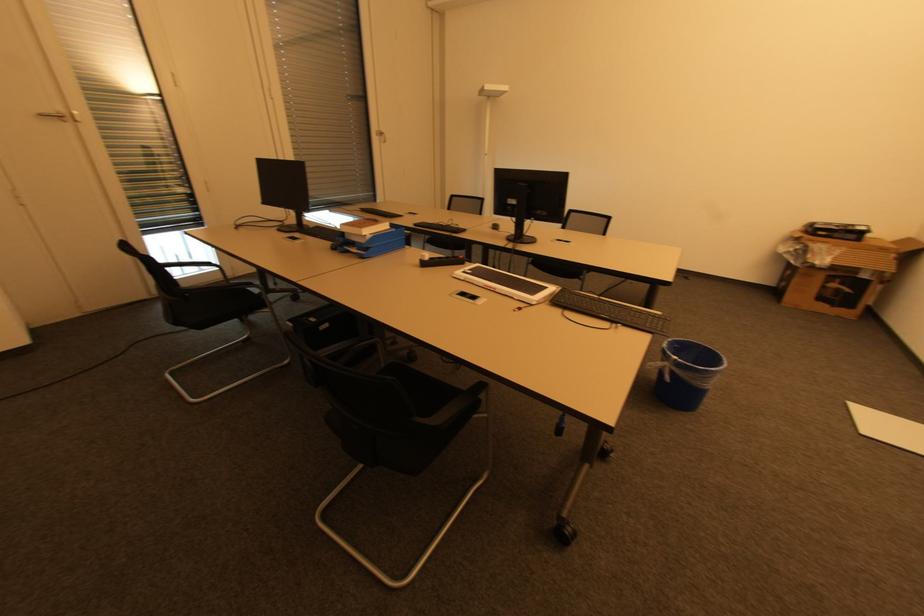
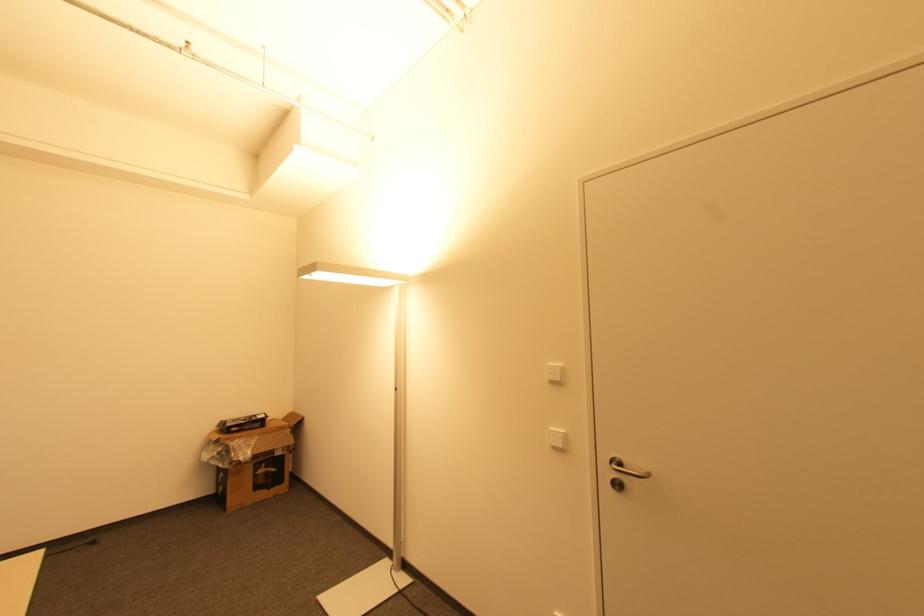
In the second image, find the point that corresponds to point 840,290 in the first image.

(268, 472)